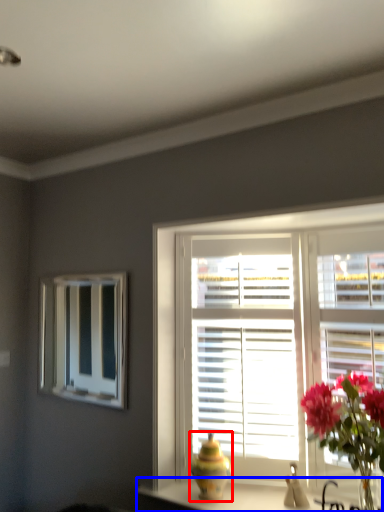
Question: Which object is further to the camera taking this photo, vase (highlighted by a red box) or counter top (highlighted by a blue box)?

Choices:
 (A) vase
 (B) counter top

Answer: (A)